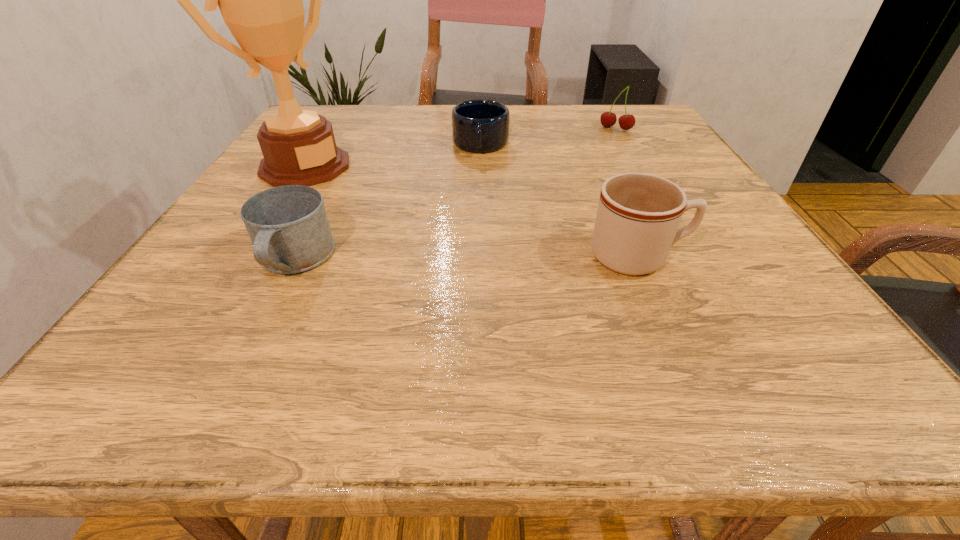
The width and height of the screenshot is (960, 540). I want to click on blank region between the leftmost mug and the third object from left to right, so click(388, 202).

This screenshot has width=960, height=540. Find the location of `vacant space that is in between the shortest object and the cherry`. vacant space that is in between the shortest object and the cherry is located at coordinates (548, 137).

The width and height of the screenshot is (960, 540). What are the coordinates of `empty space between the shortest mug and the leftmost mug` in the screenshot? It's located at (388, 202).

The width and height of the screenshot is (960, 540). I want to click on free space between the leftmost mug and the cherry, so click(x=455, y=194).

You are a GUI agent. You are given a task and a screenshot of the screen. Output one action in this format:
    pyautogui.click(x=<x>, y=<y>)
    Task: Click on the free area in between the tallest object and the shortest mug
    The width and height of the screenshot is (960, 540).
    Given the screenshot: What is the action you would take?
    pyautogui.click(x=393, y=156)

The height and width of the screenshot is (540, 960). In order to click on vacant point located between the cherry and the shortest object in this screenshot , I will do `click(548, 137)`.

Where is `free spot between the tallest mug and the tallest object`? This screenshot has width=960, height=540. free spot between the tallest mug and the tallest object is located at coordinates (472, 212).

The height and width of the screenshot is (540, 960). What are the coordinates of `free space between the leftmost mug and the tallest mug` in the screenshot? It's located at (467, 259).

This screenshot has width=960, height=540. I want to click on vacant point located between the second mug from left to right and the tallest mug, so click(x=560, y=201).

I want to click on object that is the second closest one to the leftmost mug, so click(x=480, y=126).